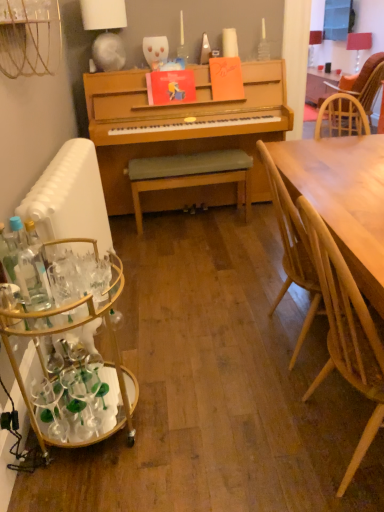
Find the location of a particular element. This screenshot has height=512, width=384. vacant region above white metallic radiator at left (from a real-world perspective) is located at coordinates (65, 160).